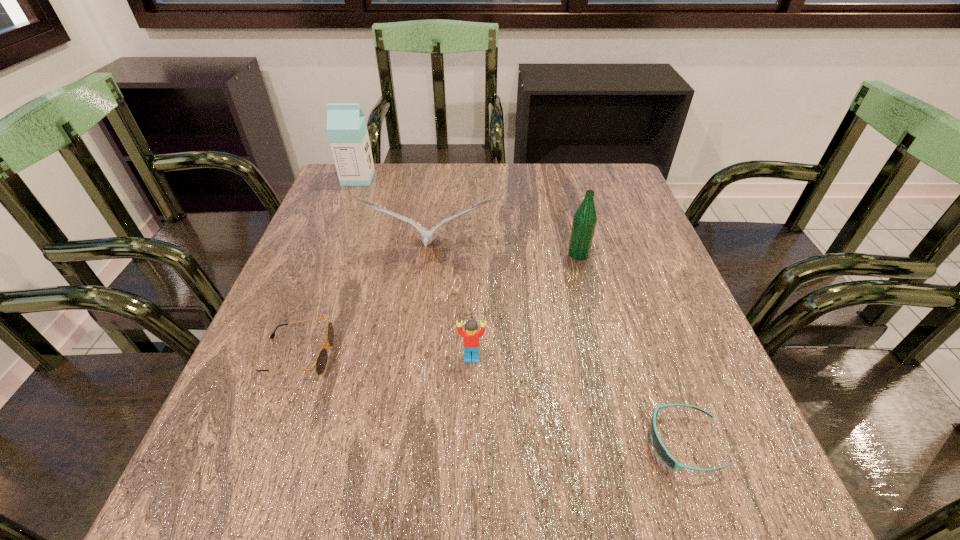
This screenshot has width=960, height=540. What are the coordinates of `free space located 0.290m at the tip of the beak of the gull` in the screenshot? It's located at click(414, 381).

Locate an element on the screen. vacant region located 0.060m on the face of the fourth tallest object is located at coordinates (471, 392).

Find the location of a particular element. The width and height of the screenshot is (960, 540). vacant space located 0.310m on the front-facing side of the farther sunglasses is located at coordinates (496, 355).

Where is `vacant space located on the front-facing side of the nearer sunglasses`? vacant space located on the front-facing side of the nearer sunglasses is located at coordinates point(528,443).

You are a GUI agent. You are given a task and a screenshot of the screen. Output one action in this format:
    pyautogui.click(x=<x>, y=<y>)
    Task: Click on the free space located 0.340m on the front-facing side of the nearer sunglasses
    
    Given the screenshot: What is the action you would take?
    pyautogui.click(x=434, y=443)

Locate an element on the screen. vacant point located on the front-facing side of the nearer sunglasses is located at coordinates (503, 443).

Find the location of `object that is at the far edge`. object that is at the far edge is located at coordinates (x=347, y=129).

You are a GUI agent. You are given a task and a screenshot of the screen. Output one action in this format:
    pyautogui.click(x=<x>, y=<y>)
    Task: Click on the object that is positioned at the near edge
    This screenshot has width=960, height=540.
    Given the screenshot: What is the action you would take?
    pyautogui.click(x=658, y=446)

Where is `milk carton at the left edge`? Image resolution: width=960 pixels, height=540 pixels. milk carton at the left edge is located at coordinates (347, 129).

Locate an element on the screen. gull that is positioned at the left edge is located at coordinates (427, 236).